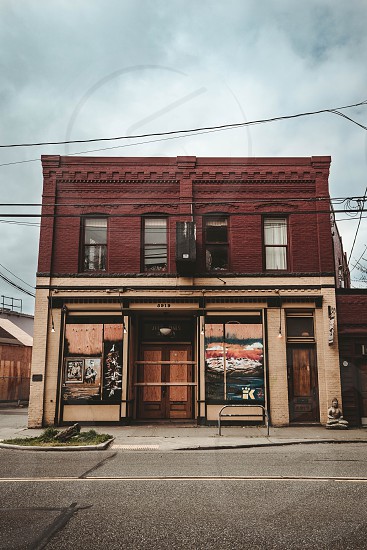
The width and height of the screenshot is (367, 550). I want to click on windows, so click(276, 250), click(215, 232), click(147, 234), click(93, 252).